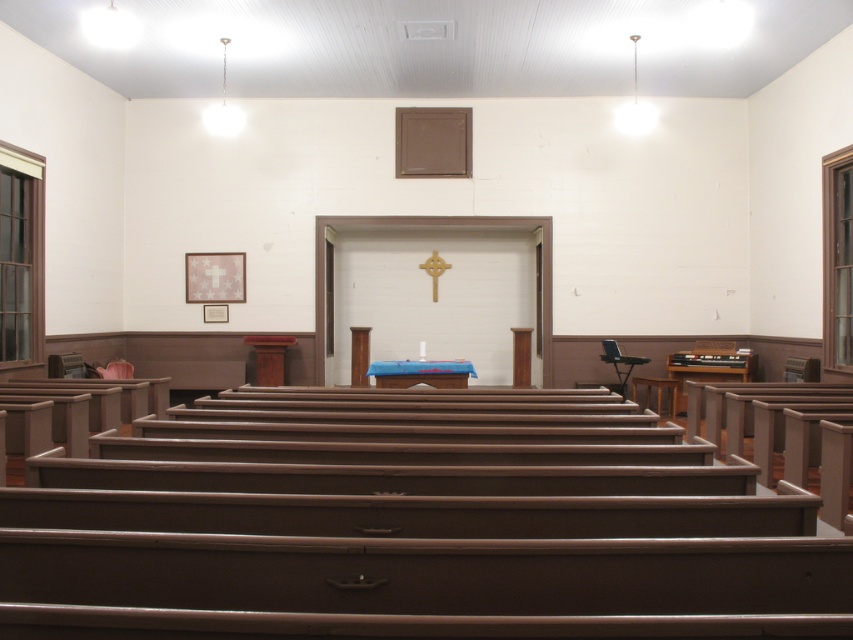
Between blue fabric altar at center and brown wooden chair at center, which one appears on the right side from the viewer's perspective?

Positioned to the right is brown wooden chair at center.

Does point (410, 371) come behind point (671, 396)?

No, (410, 371) is in front of (671, 396).

Between point (389, 376) and point (659, 390), which one is positioned behind?

Point (659, 390)

The image size is (853, 640). In order to click on blue fabric altar at center in this screenshot , I will do `click(421, 372)`.

Looking at this image, who is more forward, (660, 378) or (434, 276)?

Point (660, 378) is more forward.

Where is `brown wooden chair at center`? This screenshot has width=853, height=640. brown wooden chair at center is located at coordinates (656, 392).

Is point (437, 378) behind point (434, 291)?

No, it is not.

Find the location of a particular element. Image resolution: width=853 pixels, height=640 pixels. blue fabric altar at center is located at coordinates [421, 372].